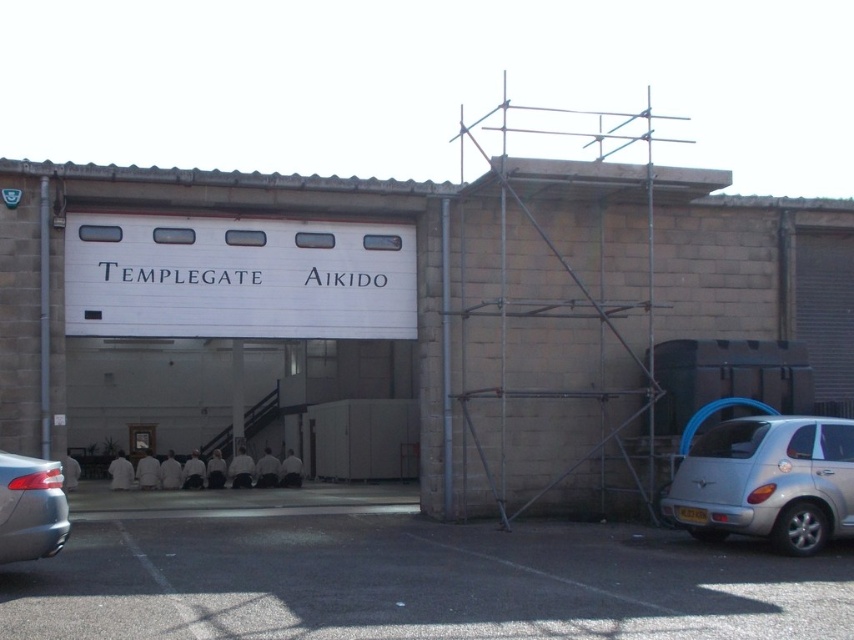
Looking at this image, you are a delivery driver who needs to park your vehicle in the black asphalt parking lot at lower center. However, there is a metallic gray sedan at lower left blocking the entrance. Can you drive into the parking lot from the current position?

The black asphalt parking lot at lower center is positioned under the metallic gray sedan at lower left, which means the sedan is parked directly above or in front of the parking lot entrance. Therefore, you cannot drive into the parking lot at this time due to the obstruction.

You are a delivery driver who needs to park your vehicle in the parking lot behind the building. The parking space is narrow and only allows vehicles shorter than 5 feet in height. You see a silver metallic car at lower right and a metallic gray sedan at lower left. Which vehicle can safely park in the space?

The metallic gray sedan at lower left can safely park in the space because it is shorter than the silver metallic car at lower right, which is under the 5 feet height requirement.